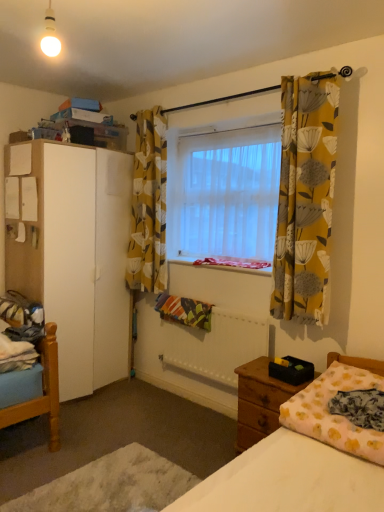
In order to click on vacant space underneath blue cotton sheet at lower left (from a real-world perspective) in this screenshot , I will do `click(23, 435)`.